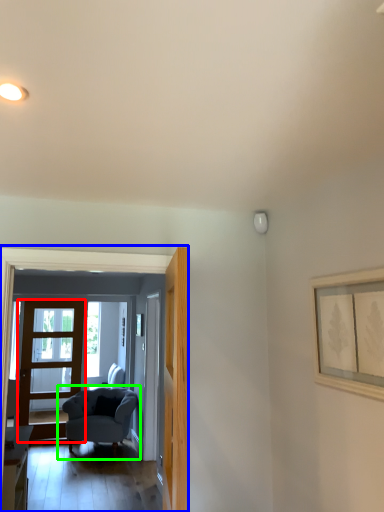
Question: Which is nearer to the door (highlighted by a red box)? residence (highlighted by a blue box) or chair (highlighted by a green box).

Choices:
 (A) residence
 (B) chair

Answer: (B)